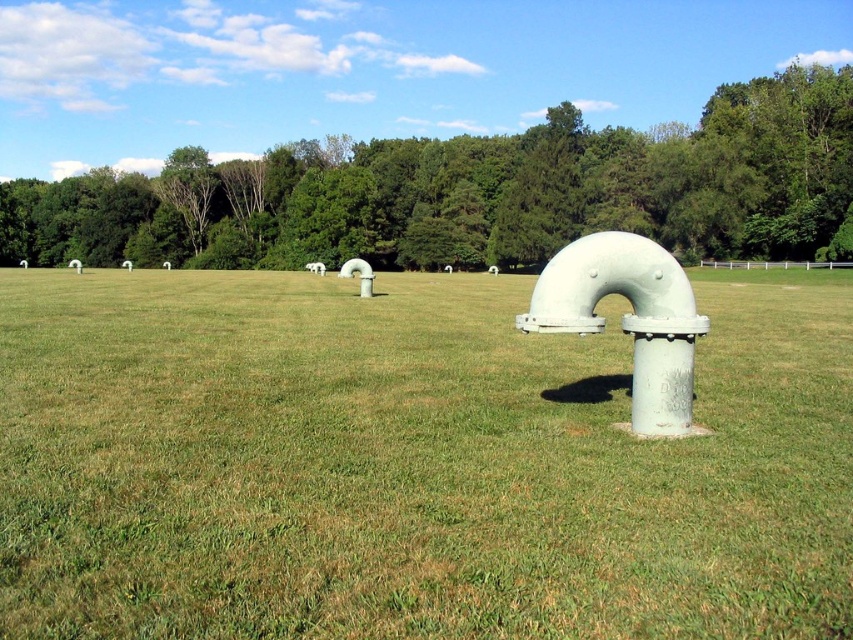
You are standing at the point with coordinates point (412, 461) in the image. What is the object directly beneath your feet?

The point (412, 461) corresponds to green grassy at center, so the object directly beneath your feet is the green grassy area at the center of the image.

You are standing in the middle of the field and want to know which object is wider when looking straight ahead. Which one is wider between the green grassy at center and the green leafy tree at center?

The green leafy tree at center is wider than the green grassy at center.